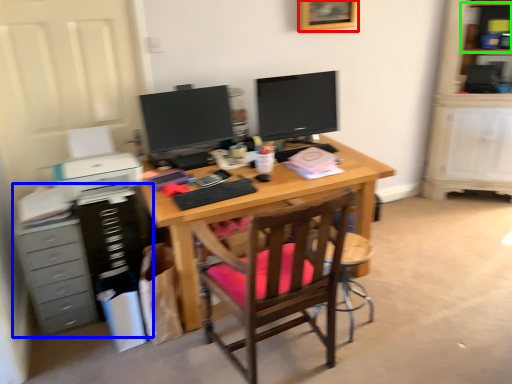
Question: Considering the real-world distances, which object is closest to picture frame (highlighted by a red box)? dresser (highlighted by a blue box) or shelf (highlighted by a green box).

Choices:
 (A) dresser
 (B) shelf

Answer: (B)